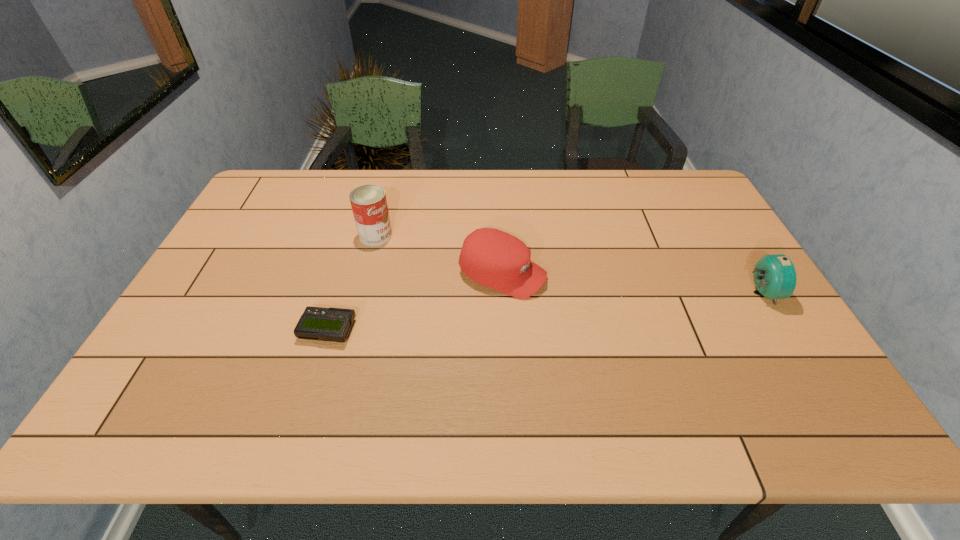
The height and width of the screenshot is (540, 960). Find the location of `the shortest object`. the shortest object is located at coordinates (330, 324).

Image resolution: width=960 pixels, height=540 pixels. I want to click on the nearest object, so click(x=330, y=324).

Locate an element on the screen. This screenshot has width=960, height=540. alarm clock is located at coordinates (774, 276).

You are a GUI agent. You are given a task and a screenshot of the screen. Output one action in this format:
    pyautogui.click(x=<x>, y=<y>)
    Task: Click on the tallest object
    The image size is (960, 540).
    Given the screenshot: What is the action you would take?
    pyautogui.click(x=369, y=205)

Locate an element on the screen. Image resolution: width=960 pixels, height=540 pixels. the farthest object is located at coordinates (369, 205).

Locate an element on the screen. The height and width of the screenshot is (540, 960). cap is located at coordinates (492, 258).

The height and width of the screenshot is (540, 960). What are the coordinates of `vacant area situated on the right of the shortest object` in the screenshot? It's located at (490, 330).

I want to click on vacant point located 0.210m on the front label of the can, so click(x=444, y=267).

The height and width of the screenshot is (540, 960). What are the coordinates of `free space located on the front label of the can` in the screenshot? It's located at (400, 247).

I want to click on free space located 0.180m on the front label of the can, so click(x=435, y=263).